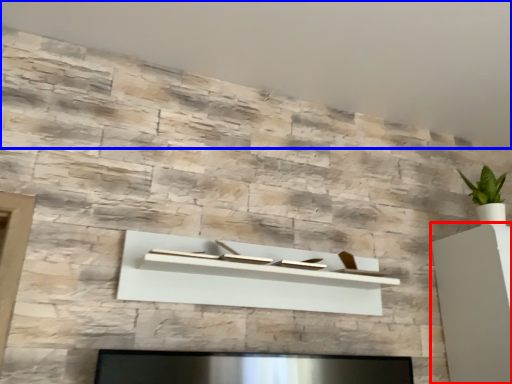
Question: Which point is further to the camera, furniture (highlighted by a red box) or backdrop (highlighted by a blue box)?

Choices:
 (A) furniture
 (B) backdrop

Answer: (A)